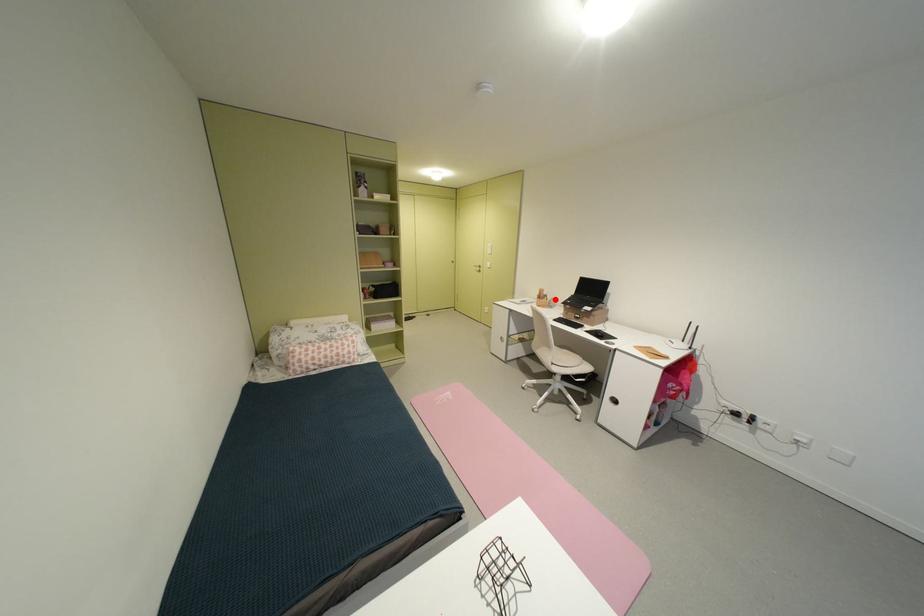
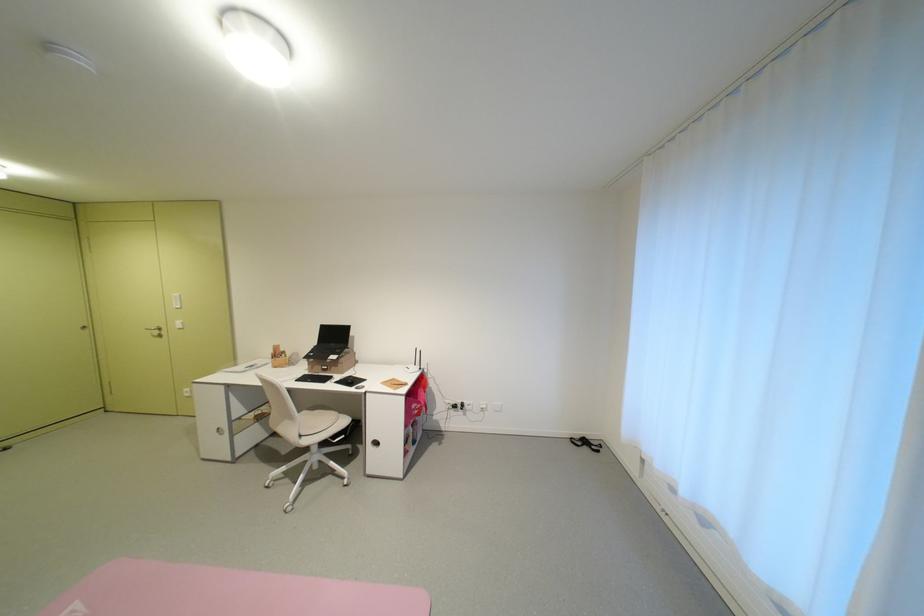
Where in the second image is the point corresponding to the highlighted location from the first image?

(293, 357)